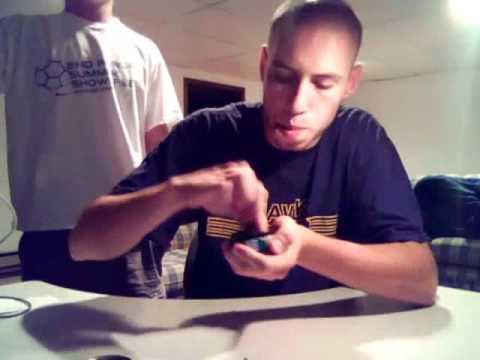
Identify the location of brown door frame. The image size is (480, 360). (188, 80).